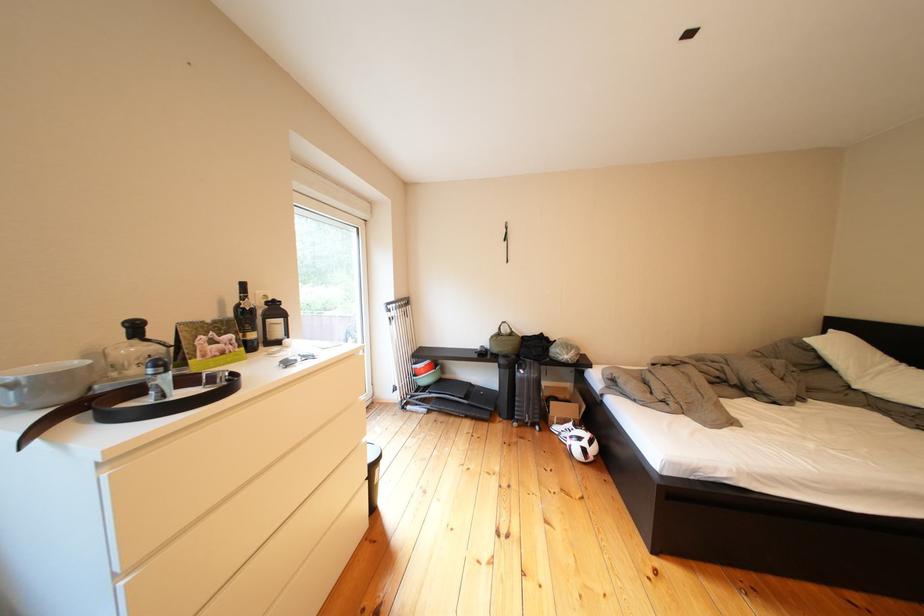
Where is `grinder crank handle`? grinder crank handle is located at coordinates (140, 331).